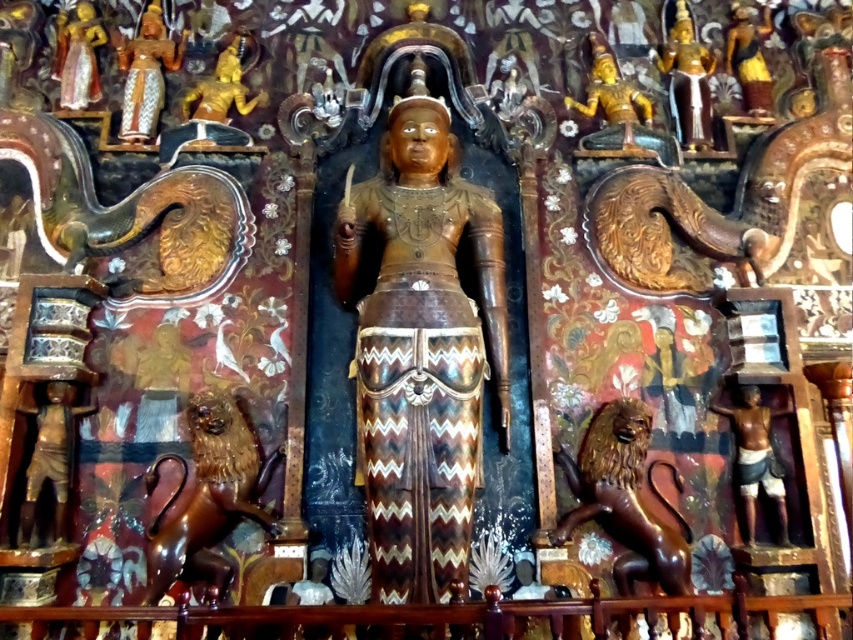
Is point (190, 428) closer to viewer compared to point (724, 406)?

Yes.

At what (x,y) coordinates should I click in order to perform the action: click on shiny brown lion at lower left. Please return your answer as a coordinate pair (x, y). Looking at the image, I should click on (207, 497).

Can you confirm if bronze figure at lower left is smaller than gold polished statue at upper center?

Yes, bronze figure at lower left is smaller than gold polished statue at upper center.

Does point (55, 456) lie in front of point (669, 51)?

That is True.

Identify the location of bronze figure at lower left. The image size is (853, 640). (50, 458).

Between point (735, 474) and point (704, 102), which one is positioned in front?

Point (735, 474) is more forward.

Between point (753, 536) and point (676, 60), which one is positioned in front?

Positioned in front is point (753, 536).

Image resolution: width=853 pixels, height=640 pixels. I want to click on bronze figure at lower right, so click(755, 456).